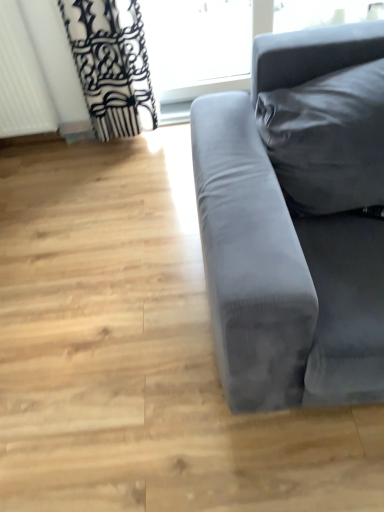
Question: Considering the positions of velvet gray couch at right and white textured radiator at left in the image, is velvet gray couch at right wider or thinner than white textured radiator at left?

Choices:
 (A) wide
 (B) thin

Answer: (A)

Question: Would you say velvet gray couch at right is to the left or to the right of white textured radiator at left in the picture?

Choices:
 (A) right
 (B) left

Answer: (A)

Question: Which is nearer to the transparent glass window at upper center?

Choices:
 (A) velvet gray couch at right
 (B) white textured radiator at left

Answer: (B)

Question: Considering the real-world distances, which object is closest to the white textured radiator at left?

Choices:
 (A) transparent glass window at upper center
 (B) velvet gray couch at right

Answer: (A)